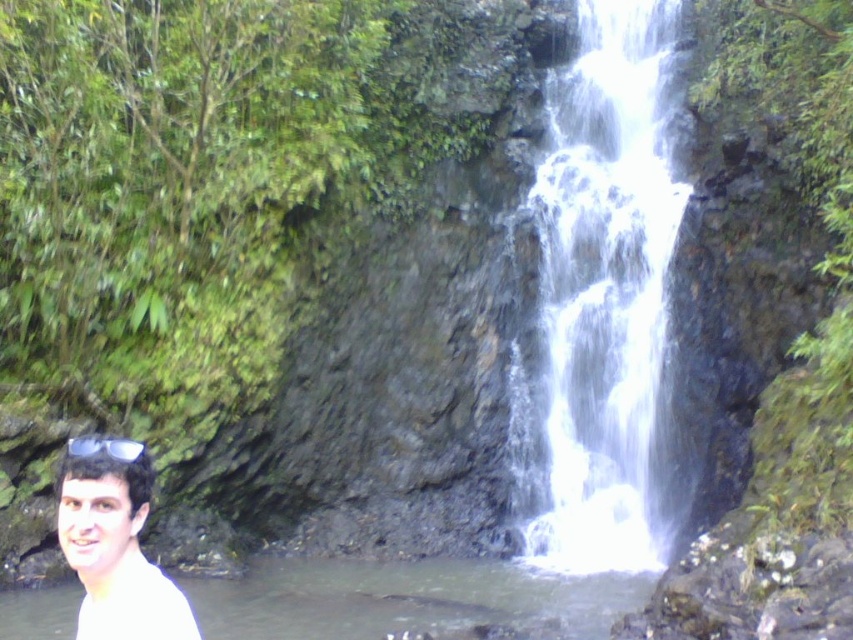
Question: Does white matte shirt at lower left have a greater width compared to clear plastic goggles at lower left?

Choices:
 (A) no
 (B) yes

Answer: (A)

Question: Which object appears closest to the camera in this image?

Choices:
 (A) white matte shirt at lower left
 (B) clear water at lower left
 (C) clear plastic goggles at lower left
 (D) white frothy water at center

Answer: (A)

Question: Among these points, which one is farthest from the camera?

Choices:
 (A) (74, 454)
 (B) (70, 460)
 (C) (553, 177)
 (D) (409, 614)

Answer: (C)

Question: Which point is farther from the camera taking this photo?

Choices:
 (A) (180, 586)
 (B) (611, 33)
 (C) (143, 451)
 (D) (61, 513)

Answer: (B)

Question: Does clear water at lower left appear on the right side of clear plastic goggles at lower left?

Choices:
 (A) no
 (B) yes

Answer: (B)

Question: Does white frothy water at center come in front of clear water at lower left?

Choices:
 (A) no
 (B) yes

Answer: (A)